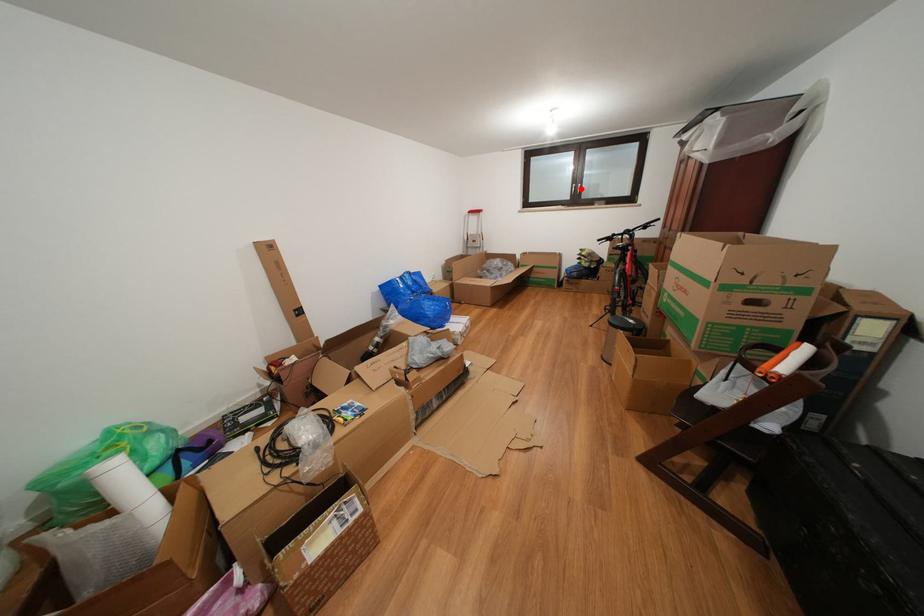
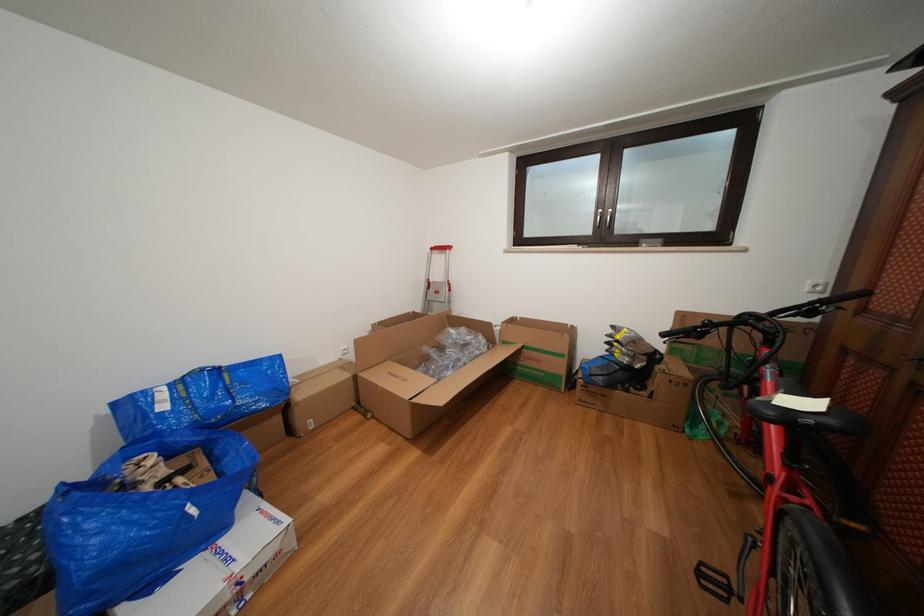
Locate, in the second image, the point that corresponds to the highlighted location in the first image.

(605, 214)